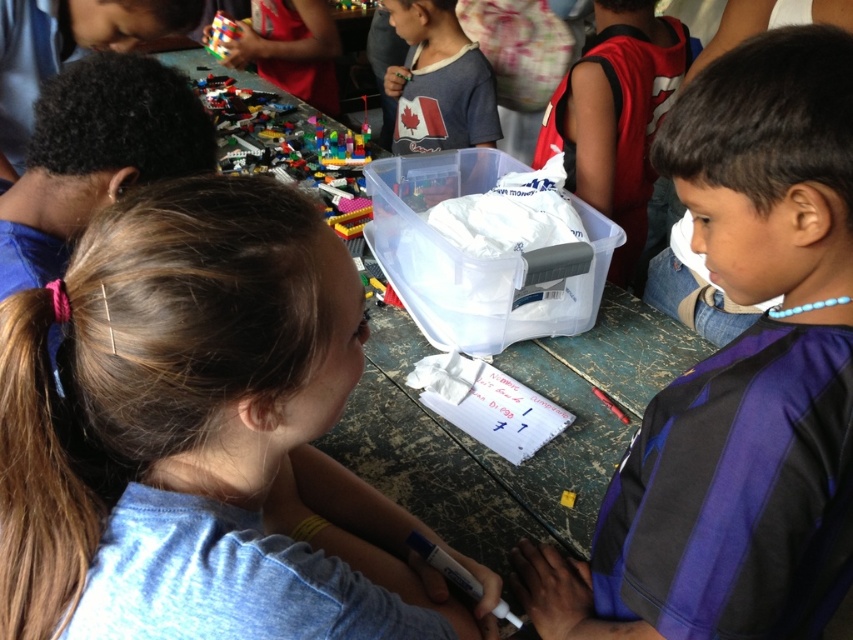
Question: Where is purple fabric shirt at center located in relation to rubik's cube at upper left in the image?

Choices:
 (A) below
 (B) above

Answer: (A)

Question: Among these points, which one is farthest from the camera?

Choices:
 (A) 640,29
 (B) 218,29
 (C) 26,396

Answer: (B)

Question: Does matte white shirt at center have a smaller size compared to white plastic container at center?

Choices:
 (A) yes
 (B) no

Answer: (B)

Question: Which object appears farthest from the camera in this image?

Choices:
 (A) smooth blue shirt at center
 (B) purple fabric shirt at center
 (C) rubik's cube at upper left
 (D) white paper at center

Answer: (C)

Question: Considering the real-world distances, which object is farthest from the white plastic container at center?

Choices:
 (A) smooth blue shirt at center
 (B) rubik's cube at upper left
 (C) purple fabric shirt at center
 (D) matte white shirt at center

Answer: (A)

Question: Does matte white shirt at center have a larger size compared to white paper at center?

Choices:
 (A) yes
 (B) no

Answer: (A)